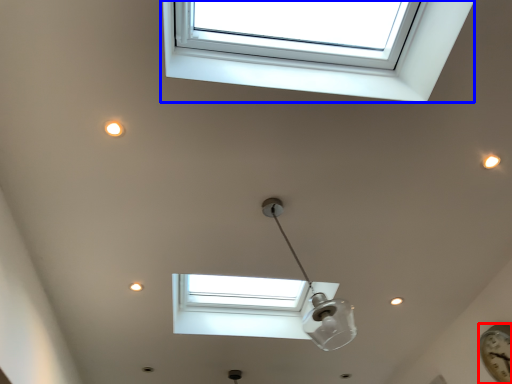
Question: Which object is closer to the camera taking this photo, clock (highlighted by a red box) or window (highlighted by a blue box)?

Choices:
 (A) clock
 (B) window

Answer: (B)